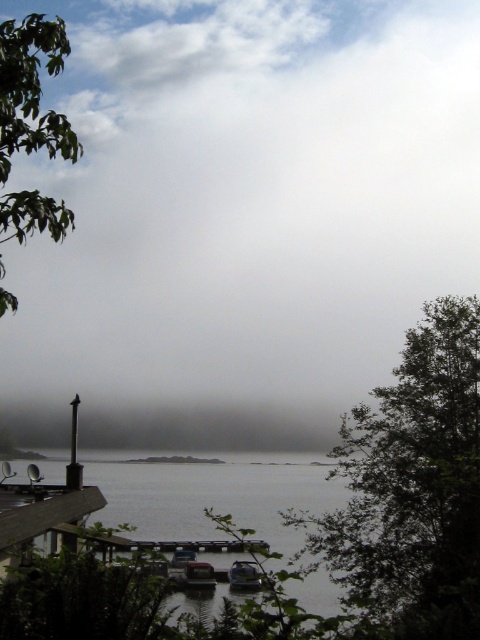
This screenshot has width=480, height=640. I want to click on green leafy tree at upper left, so click(x=32, y=90).

This screenshot has width=480, height=640. In order to click on green leafy tree at upper left in this screenshot , I will do `click(32, 90)`.

I want to click on green leafy tree at upper left, so click(x=32, y=90).

Between foggy mist at center and green leafy tree at right, which one has more height?

foggy mist at center is taller.

Find the location of a particular element. foggy mist at center is located at coordinates (241, 218).

Is green leafy tree at right shorter than white plastic boat at lower center?

In fact, green leafy tree at right may be taller than white plastic boat at lower center.

Which is more to the right, green leafy tree at right or white plastic boat at lower center?

From the viewer's perspective, green leafy tree at right appears more on the right side.

Measure the distance between point (335, 468) and camera.

They are 30.30 meters apart.

You are a GUI agent. You are given a task and a screenshot of the screen. Output one action in this format:
    pyautogui.click(x=<x>, y=<y>)
    Task: Click on the green leafy tree at right
    The image size is (480, 640).
    Given the screenshot: What is the action you would take?
    pyautogui.click(x=412, y=486)